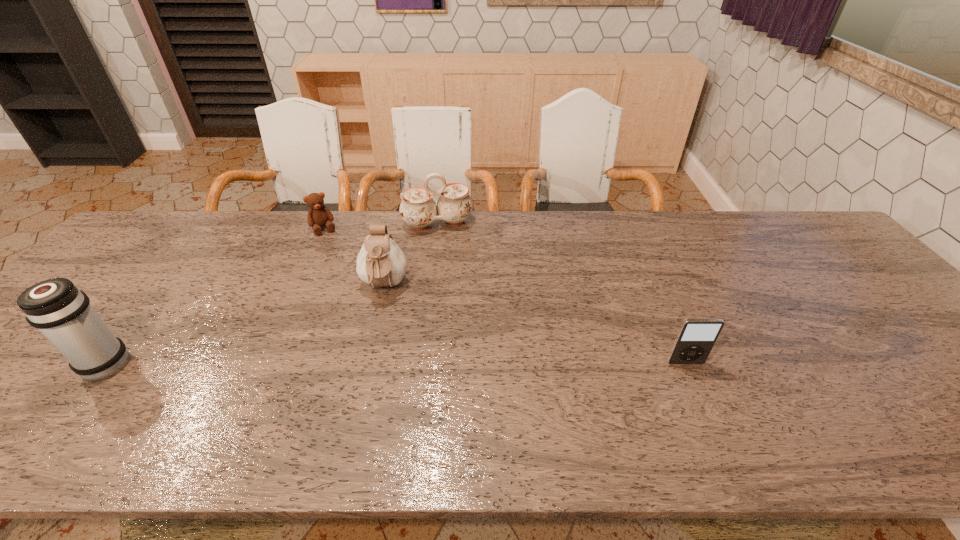
Locate an element on the screen. The width and height of the screenshot is (960, 540). vacant space on the desktop that is between the tallest object and the fourth tallest object and is positioned on the face of the teddy bear is located at coordinates (392, 364).

Find the location of a particular element. This screenshot has width=960, height=540. vacant space on the desktop that is between the tallest object and the iPod and is positioned on the front-facing side of the third farthest object is located at coordinates (375, 364).

Where is `free space on the desktop that is between the leftmost object and the rightmost object and is positioned by the handle of the chinaware`? This screenshot has width=960, height=540. free space on the desktop that is between the leftmost object and the rightmost object and is positioned by the handle of the chinaware is located at coordinates (475, 363).